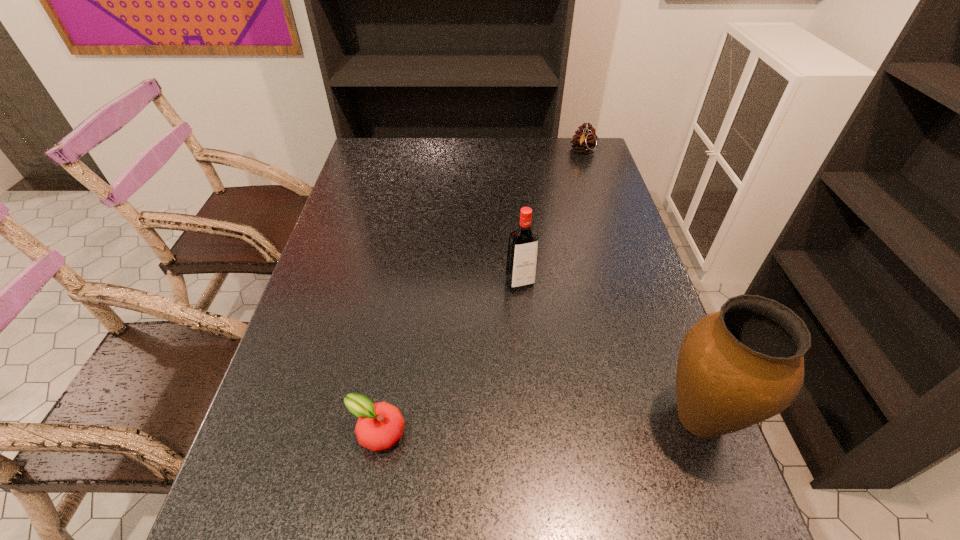
Locate an element on the screen. The width and height of the screenshot is (960, 540). free space on the desktop that is between the leftmost object and the tallest object and is positioned on the front and back of the second object from left to right is located at coordinates (587, 423).

Find the location of a particular element. The width and height of the screenshot is (960, 540). vacant space on the desktop that is between the leftmost object and the tallest object and is positioned with a leaf charm attached to the farthest object is located at coordinates (503, 428).